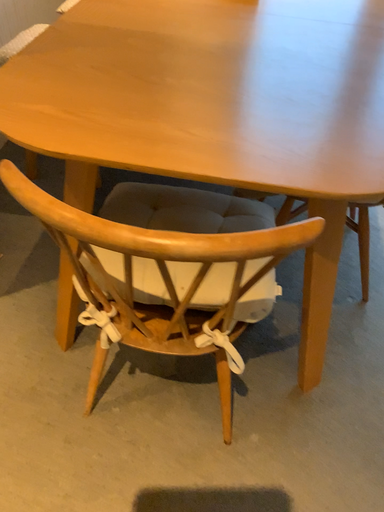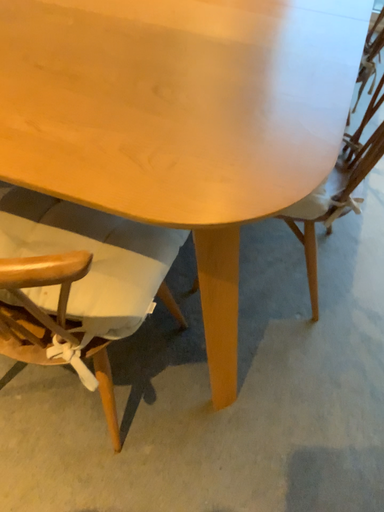
Question: Which way did the camera rotate in the video?

Choices:
 (A) rotated right
 (B) rotated left

Answer: (B)